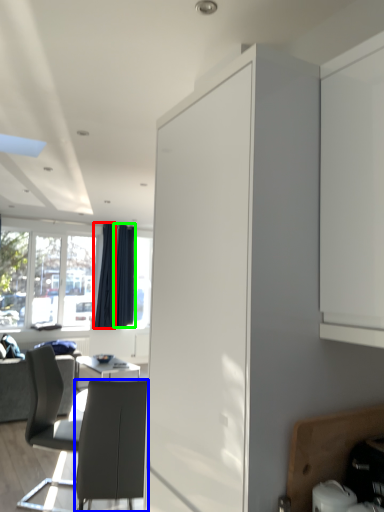
Question: Which is nearer to the curtain (highlighted by a red box)? chair (highlighted by a blue box) or curtain (highlighted by a green box).

Choices:
 (A) chair
 (B) curtain

Answer: (B)